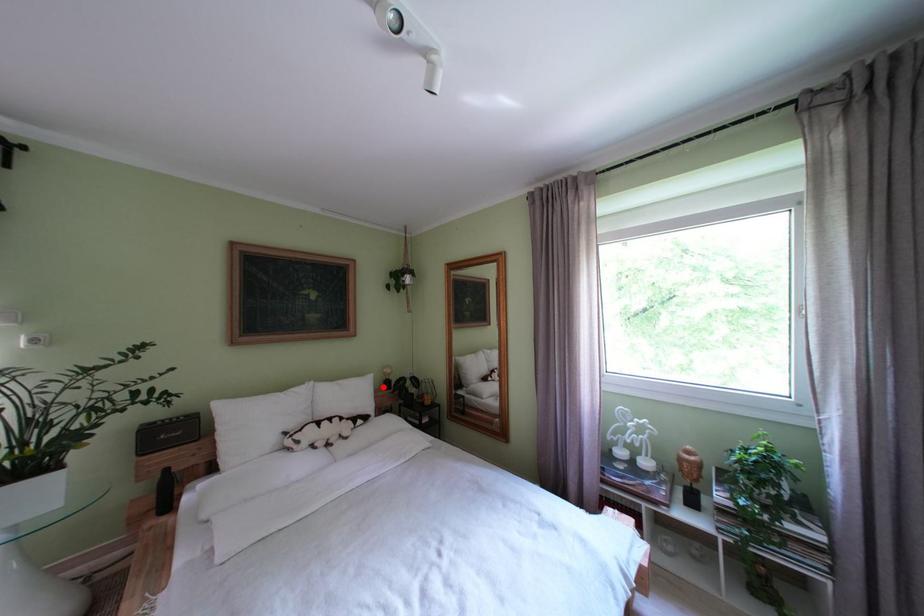
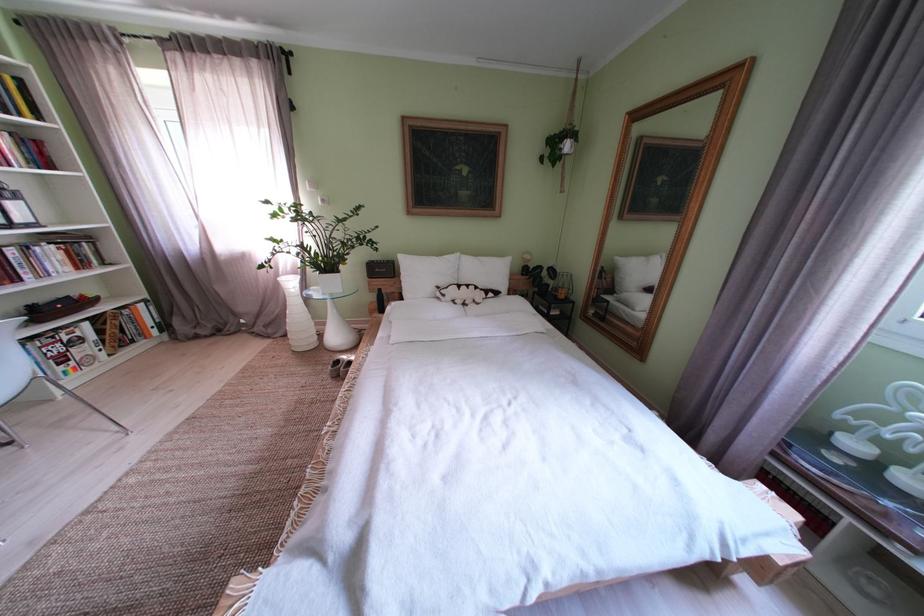
The point at the highlighted location is marked in the first image. Where is the corresponding point in the second image?

(520, 270)